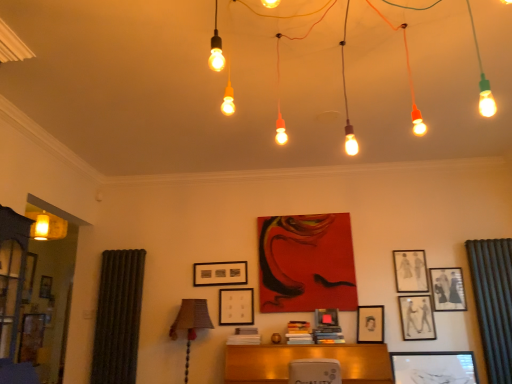
This screenshot has height=384, width=512. What do you see at coordinates (447, 289) in the screenshot?
I see `matte black picture frame at upper right, the seventh picture frame positioned from the left` at bounding box center [447, 289].

Describe the element at coordinates (326, 318) in the screenshot. The width and height of the screenshot is (512, 384). I see `matte black picture frame at center, the 5th picture frame when ordered from right to left` at that location.

At what (x,y) coordinates should I click in order to perform the action: click on matte black picture frame at center, the first picture frame when ordered from left to right. Please return your answer as a coordinate pair (x, y). The height and width of the screenshot is (384, 512). Looking at the image, I should click on (220, 273).

Image resolution: width=512 pixels, height=384 pixels. Describe the element at coordinates (220, 273) in the screenshot. I see `matte black picture frame at center, the first picture frame when ordered from left to right` at that location.

What do you see at coordinates (417, 318) in the screenshot?
I see `matte black picture frame at center-right, which ranks as the 2th picture frame in right-to-left order` at bounding box center [417, 318].

At what (x,y) coordinates should I click in order to perform the action: click on brown fabric lampshade at lower left. Please return your answer as a coordinate pair (x, y). Image resolution: width=512 pixels, height=384 pixels. Looking at the image, I should click on [190, 323].

At what (x,y) coordinates should I click in order to perform the action: click on matte black picture frame at center, which is counted as the fourth picture frame, starting from the right. Please return your answer as a coordinate pair (x, y). Image resolution: width=512 pixels, height=384 pixels. Looking at the image, I should click on (370, 324).

Is matte black picture frame at upper right, which appears as the third picture frame when viewed from the right, to the left or to the right of brown fabric lampshade at lower left in the image?

Based on their positions, matte black picture frame at upper right, which appears as the third picture frame when viewed from the right, is located to the right of brown fabric lampshade at lower left.

Considering the relative sizes of matte black picture frame at upper right, the fifth picture frame viewed from the left, and brown fabric lampshade at lower left in the image provided, is matte black picture frame at upper right, the fifth picture frame viewed from the left, taller than brown fabric lampshade at lower left?

In fact, matte black picture frame at upper right, the fifth picture frame viewed from the left, may be shorter than brown fabric lampshade at lower left.

In the scene shown: From the image's perspective, would you say matte black picture frame at upper right, the fifth picture frame viewed from the left, is shown under brown fabric lampshade at lower left?

No.

Is matte glass lightbulbs at upper center located within wooden desk at center?

No.

Considering the positions of objects wooden desk at center and matte glass lightbulbs at upper center in the image provided, who is more to the right, wooden desk at center or matte glass lightbulbs at upper center?

Positioned to the right is matte glass lightbulbs at upper center.

From the image's perspective, would you say wooden desk at center is shown under matte glass lightbulbs at upper center?

Yes, from the image's perspective, wooden desk at center is below matte glass lightbulbs at upper center.

Does wooden desk at center turn towards matte glass lightbulbs at upper center?

No, wooden desk at center is not facing towards matte glass lightbulbs at upper center.

From a real-world perspective, is matte black picture frame at center, the third picture frame from the left, positioned under matte black picture frame at upper right, which appears as the third picture frame when viewed from the right, based on gravity?

Yes.

Is matte black picture frame at center, the third picture frame from the left, bigger than matte black picture frame at upper right, the fifth picture frame viewed from the left?

No.

Is matte black picture frame at center, the third picture frame from the left, oriented towards matte black picture frame at upper right, which appears as the third picture frame when viewed from the right?

No.

Based on the photo, choose the correct answer: Is brown fabric lampshade at lower left inside green textured curtain at right or outside it?

brown fabric lampshade at lower left is outside green textured curtain at right.

Which of these two, brown fabric lampshade at lower left or green textured curtain at right, stands shorter?

Standing shorter between the two is brown fabric lampshade at lower left.

Does point (191, 314) appear closer or farther from the camera than point (481, 254)?

Clearly, point (191, 314) is closer to the camera than point (481, 254).

How much distance is there between brown fabric lampshade at lower left and green textured curtain at right?

brown fabric lampshade at lower left is 2.54 meters away from green textured curtain at right.

Starting from the matte black picture frame at center, placed as the fourth picture frame when sorted from left to right, which picture frame is the 2nd one to the right? Please provide its 2D coordinates.

[(417, 318)]

Does point (370, 341) appear closer or farther from the camera than point (425, 298)?

Clearly, point (370, 341) is closer to the camera than point (425, 298).

From a real-world perspective, is matte black picture frame at center, placed as the fourth picture frame when sorted from left to right, positioned above or below matte black picture frame at center-right, acting as the 6th picture frame starting from the left?

matte black picture frame at center, placed as the fourth picture frame when sorted from left to right, is below matte black picture frame at center-right, acting as the 6th picture frame starting from the left.

Between matte black picture frame at center, placed as the fourth picture frame when sorted from left to right, and matte black picture frame at center-right, which ranks as the 2th picture frame in right-to-left order, which one has larger width?

matte black picture frame at center, placed as the fourth picture frame when sorted from left to right.

Is there a large distance between green textured curtain at right and matte black picture frame at center-right, acting as the 6th picture frame starting from the left?

green textured curtain at right is near matte black picture frame at center-right, acting as the 6th picture frame starting from the left, not far away.

The width and height of the screenshot is (512, 384). In order to click on curtain on the right of matte black picture frame at center-right, which ranks as the 2th picture frame in right-to-left order in this screenshot , I will do `click(493, 303)`.

Can you confirm if green textured curtain at right is thinner than matte black picture frame at center-right, acting as the 6th picture frame starting from the left?

Incorrect, the width of green textured curtain at right is not less than that of matte black picture frame at center-right, acting as the 6th picture frame starting from the left.

Is brown fabric lampshade at lower left closer to the viewer compared to wooden picture frame at center, the second picture frame positioned from the left?

That is True.

Can you confirm if brown fabric lampshade at lower left is bigger than wooden picture frame at center, the second picture frame positioned from the left?

Indeed, brown fabric lampshade at lower left has a larger size compared to wooden picture frame at center, the second picture frame positioned from the left.

Considering the sizes of brown fabric lampshade at lower left and wooden picture frame at center, positioned as the 6th picture frame in right-to-left order, in the image, is brown fabric lampshade at lower left taller or shorter than wooden picture frame at center, positioned as the 6th picture frame in right-to-left order,?

In the image, brown fabric lampshade at lower left appears to be taller than wooden picture frame at center, positioned as the 6th picture frame in right-to-left order.

From a real-world perspective, which is physically above, brown fabric lampshade at lower left or wooden picture frame at center, positioned as the 6th picture frame in right-to-left order?

wooden picture frame at center, positioned as the 6th picture frame in right-to-left order, from a real-world perspective.

This screenshot has width=512, height=384. I want to click on the 6th picture frame directly above the brown fabric lampshade at lower left (from a real-world perspective), so click(x=410, y=271).

Find the location of a particular element. furniture below the matte glass lightbulbs at upper center (from the image's perspective) is located at coordinates (306, 358).

Based on their spatial positions, is matte black picture frame at center, the first picture frame when ordered from left to right, or matte black picture frame at center, the third picture frame from the left, closer to matte black picture frame at upper right, the seventh picture frame positioned from the left?

matte black picture frame at center, the third picture frame from the left, is closer to matte black picture frame at upper right, the seventh picture frame positioned from the left.

Consider the image. Based on their spatial positions, is matte black picture frame at upper right, the seventh picture frame positioned from the left, or matte black picture frame at center, which is counted as the fourth picture frame, starting from the right, further from matte black picture frame at center, the first picture frame when ordered from left to right?

Among the two, matte black picture frame at upper right, the seventh picture frame positioned from the left, is located further to matte black picture frame at center, the first picture frame when ordered from left to right.

When comparing their distances from matte black picture frame at center, which is the seventh picture frame in right-to-left order, does matte black picture frame at center, which is counted as the fourth picture frame, starting from the right, or matte black picture frame at upper right, the first picture frame from the right, seem further?

matte black picture frame at upper right, the first picture frame from the right, is positioned further to the anchor matte black picture frame at center, which is the seventh picture frame in right-to-left order.

Estimate the real-world distances between objects in this image. Which object is closer to matte glass lightbulbs at upper center, matte black picture frame at center, which is the seventh picture frame in right-to-left order, or matte black picture frame at upper right, the first picture frame from the right?

Among the two, matte black picture frame at upper right, the first picture frame from the right, is located nearer to matte glass lightbulbs at upper center.

Looking at this image, based on their spatial positions, is green textured curtain at right or wooden picture frame at center, the second picture frame positioned from the left, closer to matte black picture frame at center-right, which ranks as the 2th picture frame in right-to-left order?

The object closer to matte black picture frame at center-right, which ranks as the 2th picture frame in right-to-left order, is green textured curtain at right.

Looking at the image, which one is located further to wooden desk at center, matte black picture frame at center-right, which ranks as the 2th picture frame in right-to-left order, or brown fabric lampshade at lower left?

Based on the image, matte black picture frame at center-right, which ranks as the 2th picture frame in right-to-left order, appears to be further to wooden desk at center.

Considering their positions, is wooden picture frame at center, the second picture frame positioned from the left, positioned closer to matte black picture frame at center, which is counted as the fourth picture frame, starting from the right, than brown fabric lampshade at lower left?

wooden picture frame at center, the second picture frame positioned from the left, is closer to matte black picture frame at center, which is counted as the fourth picture frame, starting from the right.

Which object lies nearer to the anchor point matte black picture frame at upper right, which appears as the third picture frame when viewed from the right, matte black picture frame at upper right, the seventh picture frame positioned from the left, or matte black picture frame at center, placed as the fourth picture frame when sorted from left to right?

matte black picture frame at upper right, the seventh picture frame positioned from the left, lies closer to matte black picture frame at upper right, which appears as the third picture frame when viewed from the right, than the other object.

Image resolution: width=512 pixels, height=384 pixels. I want to click on curtain between matte glass lightbulbs at upper center and matte black picture frame at upper right, which appears as the third picture frame when viewed from the right, in the front-back direction, so click(x=493, y=303).

Where is `table lamp positioned between matte glass lightbulbs at upper center and matte black picture frame at center-right, acting as the 6th picture frame starting from the left, from near to far`? This screenshot has width=512, height=384. table lamp positioned between matte glass lightbulbs at upper center and matte black picture frame at center-right, acting as the 6th picture frame starting from the left, from near to far is located at coordinates (190, 323).

Find the location of `furniture between brown fabric lampshade at lower left and matte black picture frame at upper right, the seventh picture frame positioned from the left, from left to right`. furniture between brown fabric lampshade at lower left and matte black picture frame at upper right, the seventh picture frame positioned from the left, from left to right is located at coordinates (306, 358).

You are a GUI agent. You are given a task and a screenshot of the screen. Output one action in this format:
    pyautogui.click(x=<x>, y=<y>)
    Task: Click on the table lamp positioned between matte glass lightbulbs at upper center and matte black picture frame at upper right, the fifth picture frame viewed from the left, from near to far
    This screenshot has width=512, height=384.
    Given the screenshot: What is the action you would take?
    pyautogui.click(x=190, y=323)